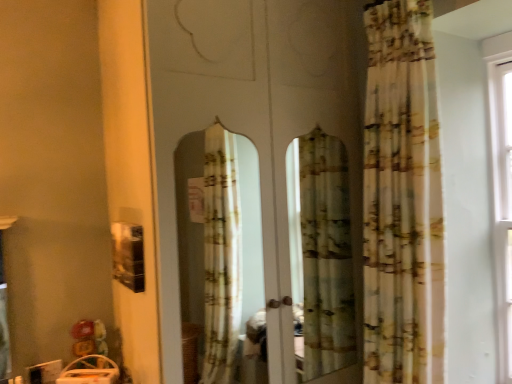
Question: From a real-world perspective, is printed fabric curtain at right on transparent glass screen door at center?

Choices:
 (A) no
 (B) yes

Answer: (B)

Question: Is printed fabric curtain at right outside of transparent glass screen door at center?

Choices:
 (A) no
 (B) yes

Answer: (B)

Question: From a real-world perspective, does printed fabric curtain at right sit lower than transparent glass screen door at center?

Choices:
 (A) no
 (B) yes

Answer: (A)

Question: Considering the relative positions of printed fabric curtain at right and transparent glass screen door at center in the image provided, is printed fabric curtain at right to the left of transparent glass screen door at center from the viewer's perspective?

Choices:
 (A) yes
 (B) no

Answer: (B)

Question: Does printed fabric curtain at right have a smaller size compared to transparent glass screen door at center?

Choices:
 (A) no
 (B) yes

Answer: (B)

Question: Considering the relative sizes of printed fabric curtain at right and transparent glass screen door at center in the image provided, is printed fabric curtain at right taller than transparent glass screen door at center?

Choices:
 (A) no
 (B) yes

Answer: (A)

Question: Is transparent glass screen door at center outside of printed fabric curtain at right?

Choices:
 (A) no
 (B) yes

Answer: (B)

Question: From the image's perspective, does transparent glass screen door at center appear lower than printed fabric curtain at right?

Choices:
 (A) yes
 (B) no

Answer: (A)

Question: Is transparent glass screen door at center thinner than printed fabric curtain at right?

Choices:
 (A) no
 (B) yes

Answer: (A)

Question: Is transparent glass screen door at center bigger than printed fabric curtain at right?

Choices:
 (A) no
 (B) yes

Answer: (B)

Question: Is transparent glass screen door at center taller than printed fabric curtain at right?

Choices:
 (A) yes
 (B) no

Answer: (A)

Question: Is transparent glass screen door at center positioned behind printed fabric curtain at right?

Choices:
 (A) yes
 (B) no

Answer: (B)

Question: In terms of height, does transparent glass screen door at center look taller or shorter compared to printed fabric curtain at right?

Choices:
 (A) short
 (B) tall

Answer: (B)